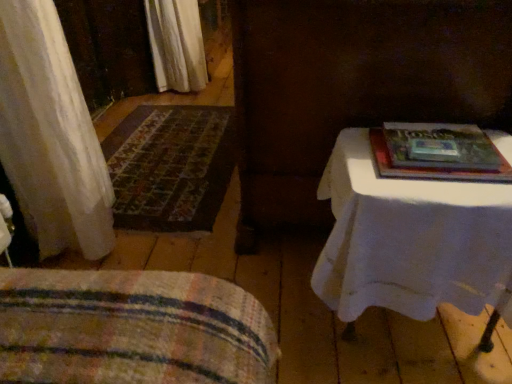
This screenshot has width=512, height=384. In order to click on empty space that is ontop of hardcover book at upper right (from a real-world perspective) in this screenshot , I will do `click(428, 138)`.